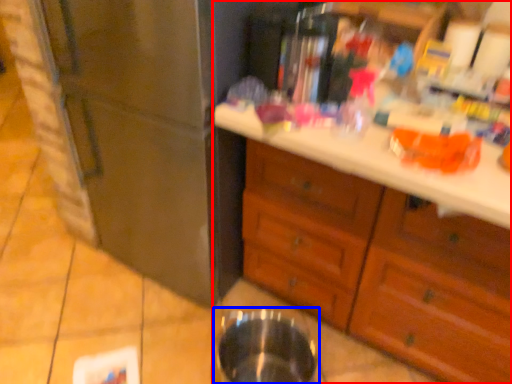
Question: Which of the following is the closest to the observer, cabinetry (highlighted by a red box) or basin (highlighted by a blue box)?

Choices:
 (A) cabinetry
 (B) basin

Answer: (A)